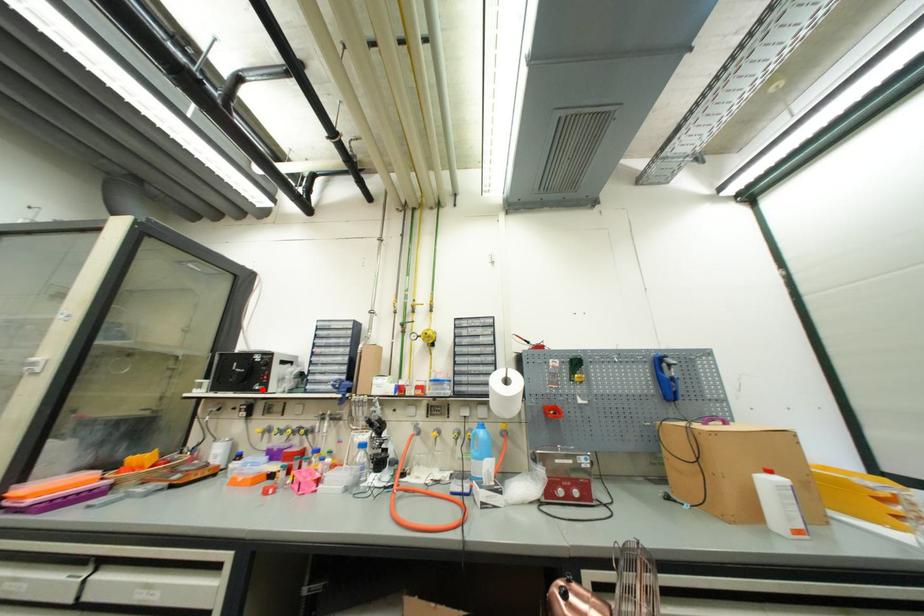
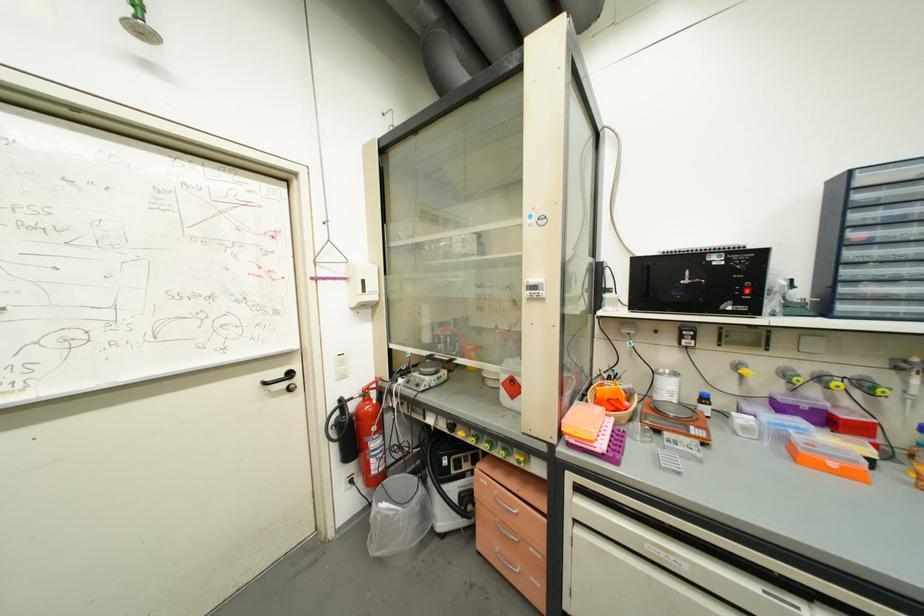
The point at the highlighted location is marked in the first image. Where is the corresponding point in the second image?

(735, 310)